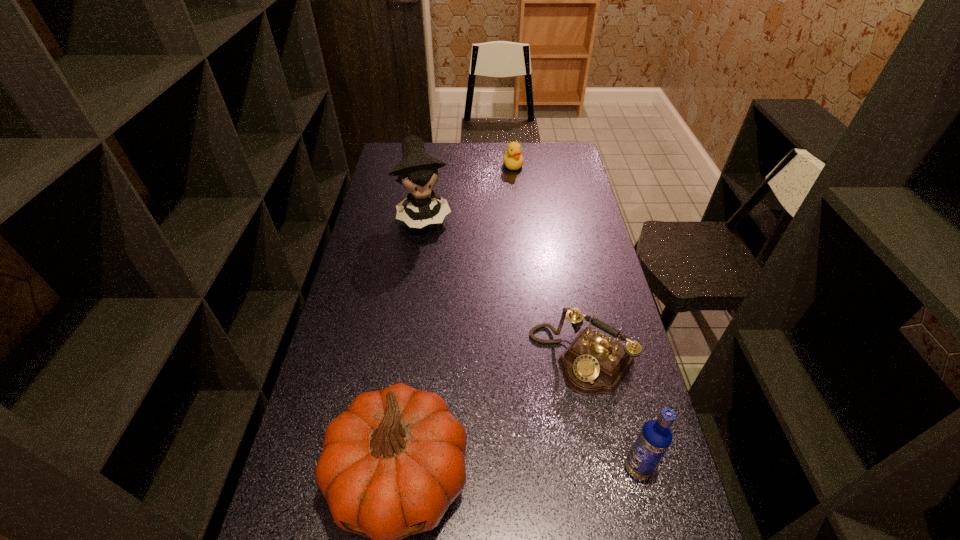
Where is `the fourth closest object to the shortest object`? The image size is (960, 540). the fourth closest object to the shortest object is located at coordinates (655, 437).

Identify the location of object that is the third closest to the vodka. Image resolution: width=960 pixels, height=540 pixels. (417, 171).

Find the location of `free region that satisfies the following two spatial constraints: 1. on the front side of the third farthest object; 2. on the right side of the vodka`. free region that satisfies the following two spatial constraints: 1. on the front side of the third farthest object; 2. on the right side of the vodka is located at coordinates (604, 468).

I want to click on free space that satisfies the following two spatial constraints: 1. on the front side of the doll; 2. on the left side of the vodka, so click(x=388, y=468).

What are the coordinates of `vacant region that satisfies the following two spatial constraints: 1. on the front side of the vodka; 2. on the left side of the shortest object` in the screenshot? It's located at (543, 468).